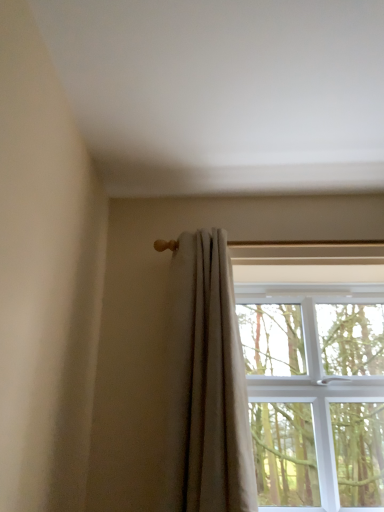
You are a GUI agent. You are given a task and a screenshot of the screen. Output one action in this format:
    pyautogui.click(x=<x>, y=<y>)
    Task: Click on the light beige fabric curtain at upper right
    
    Given the screenshot: What is the action you would take?
    pyautogui.click(x=206, y=385)

What is the approximate width of light beige fabric curtain at upper right?

It is 9.36 inches.

This screenshot has height=512, width=384. Describe the element at coordinates (206, 385) in the screenshot. I see `light beige fabric curtain at upper right` at that location.

Measure the distance between point (301, 453) and camera.

Point (301, 453) is 1.76 meters from camera.

Identify the location of clear glass window at upper right. (314, 388).

What is the approximate width of clear glass window at upper right?

clear glass window at upper right is 37.67 centimeters in width.

Describe the element at coordinates (314, 388) in the screenshot. I see `clear glass window at upper right` at that location.

Image resolution: width=384 pixels, height=512 pixels. Identify the location of light beige fabric curtain at upper right. (206, 385).

Between light beige fabric curtain at upper right and clear glass window at upper right, which one appears on the right side from the viewer's perspective?

From the viewer's perspective, clear glass window at upper right appears more on the right side.

Relative to clear glass window at upper right, is light beige fabric curtain at upper right in front or behind?

In the image, light beige fabric curtain at upper right appears in front of clear glass window at upper right.

Which point is more distant from viewer, [169,498] or [283,402]?

Point [283,402]

From the image's perspective, is light beige fabric curtain at upper right located above or below clear glass window at upper right?

Clearly, from the image's perspective, light beige fabric curtain at upper right is above clear glass window at upper right.

From a real-world perspective, is light beige fabric curtain at upper right located higher than clear glass window at upper right?

Yes.

Does light beige fabric curtain at upper right have a greater width compared to clear glass window at upper right?

No.

Considering the sizes of light beige fabric curtain at upper right and clear glass window at upper right in the image, is light beige fabric curtain at upper right taller or shorter than clear glass window at upper right?

In the image, light beige fabric curtain at upper right appears to be taller than clear glass window at upper right.

Who is bigger, light beige fabric curtain at upper right or clear glass window at upper right?

With larger size is clear glass window at upper right.

Do you think light beige fabric curtain at upper right is within clear glass window at upper right, or outside of it?

light beige fabric curtain at upper right exists outside the volume of clear glass window at upper right.

Is light beige fabric curtain at upper right not close to clear glass window at upper right?

light beige fabric curtain at upper right is actually quite close to clear glass window at upper right.

Is light beige fabric curtain at upper right turned away from clear glass window at upper right?

No, light beige fabric curtain at upper right is not facing the opposite direction of clear glass window at upper right.

Can you tell me how much light beige fabric curtain at upper right and clear glass window at upper right differ in facing direction?

The angle between the facing direction of light beige fabric curtain at upper right and the facing direction of clear glass window at upper right is 0.00372 degrees.

Where is `window that is behind the light beige fabric curtain at upper right`? The image size is (384, 512). window that is behind the light beige fabric curtain at upper right is located at coordinates (314, 388).

Between clear glass window at upper right and light beige fabric curtain at upper right, which one appears on the right side from the viewer's perspective?

clear glass window at upper right is more to the right.

Which object is closer to the camera, clear glass window at upper right or light beige fabric curtain at upper right?

light beige fabric curtain at upper right is more forward.

Which is behind, point (258, 348) or point (197, 284)?

The point (258, 348) is farther.

From the image's perspective, which one is positioned lower, clear glass window at upper right or light beige fabric curtain at upper right?

clear glass window at upper right.

From a real-world perspective, does clear glass window at upper right stand above light beige fabric curtain at upper right?

Actually, clear glass window at upper right is physically below light beige fabric curtain at upper right in the real world.

Which object is thinner, clear glass window at upper right or light beige fabric curtain at upper right?

light beige fabric curtain at upper right is thinner.

In terms of height, does clear glass window at upper right look taller or shorter compared to light beige fabric curtain at upper right?

Clearly, clear glass window at upper right is shorter compared to light beige fabric curtain at upper right.

Which of these two, clear glass window at upper right or light beige fabric curtain at upper right, is bigger?

clear glass window at upper right.

Do you think clear glass window at upper right is within light beige fabric curtain at upper right, or outside of it?

clear glass window at upper right is not enclosed by light beige fabric curtain at upper right.

Is clear glass window at upper right next to light beige fabric curtain at upper right?

No, clear glass window at upper right is not beside light beige fabric curtain at upper right.

Is clear glass window at upper right facing away from light beige fabric curtain at upper right?

That's not correct — clear glass window at upper right is not looking away from light beige fabric curtain at upper right.

How distant is clear glass window at upper right from light beige fabric curtain at upper right?

The distance of clear glass window at upper right from light beige fabric curtain at upper right is 48.89 centimeters.

Identify the location of curtain on the left of clear glass window at upper right. (206, 385).

I want to click on window on the right of light beige fabric curtain at upper right, so click(x=314, y=388).

Locate an element on the screen. curtain that is on the left side of clear glass window at upper right is located at coordinates (206, 385).